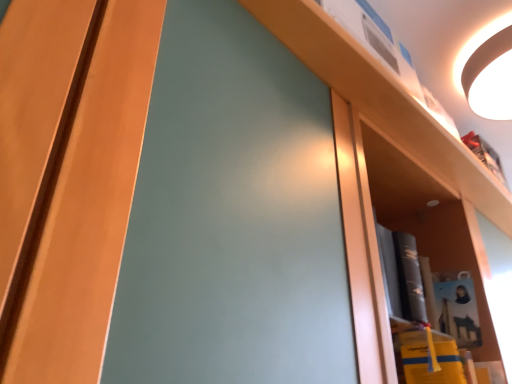
Question: Should I look upward or downward to see white glossy lampshade at upper right?

Choices:
 (A) up
 (B) down

Answer: (A)